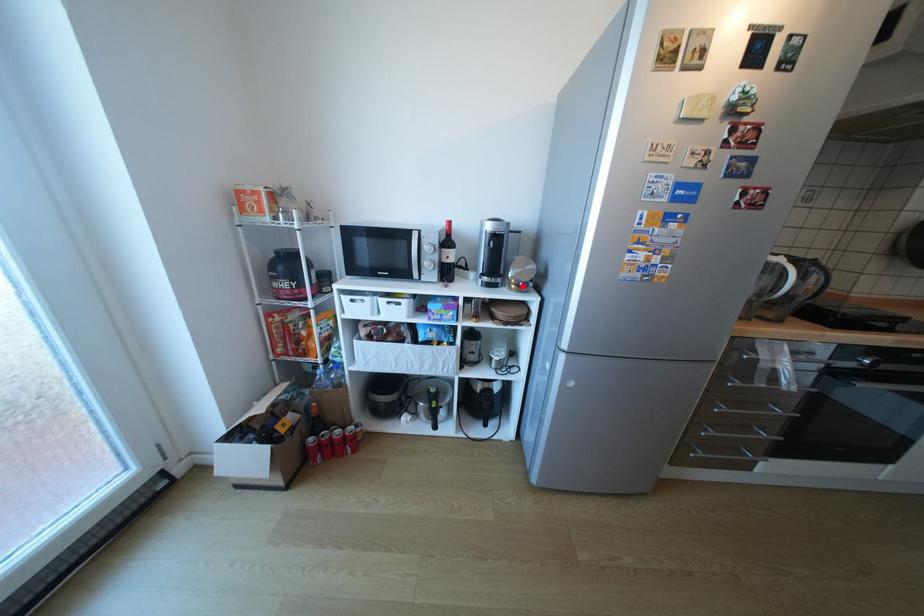
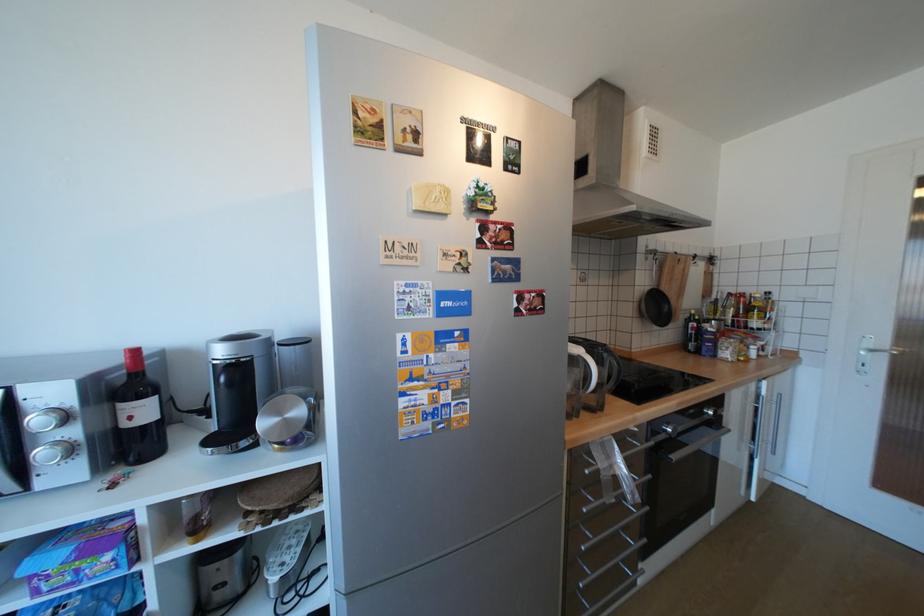
The point at the highlighted location is marked in the first image. Where is the corresponding point in the second image?

(286, 446)